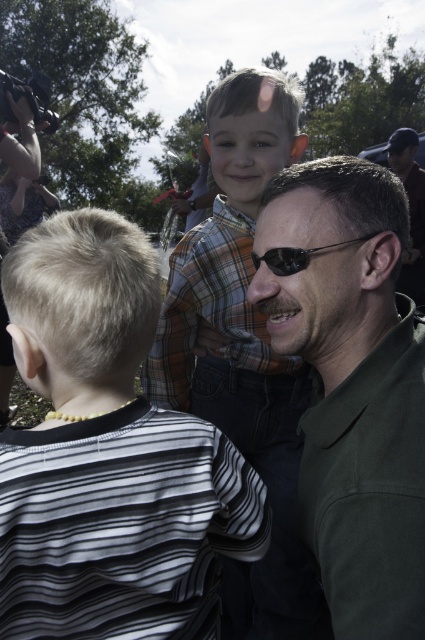
Does plaid shirt at center have a smaller size compared to black plastic sunglasses at center?

Actually, plaid shirt at center might be larger than black plastic sunglasses at center.

Image resolution: width=425 pixels, height=640 pixels. Identify the location of plaid shirt at center. (241, 346).

Image resolution: width=425 pixels, height=640 pixels. Identify the location of plaid shirt at center. point(241,346).

Between point (380, 300) and point (291, 266), which one is positioned behind?

Positioned behind is point (380, 300).

Is the position of green matte shirt at center more distant than that of black plastic sunglasses at center?

No, green matte shirt at center is in front of black plastic sunglasses at center.

Measure the distance between point (254, 289) and camera.

A distance of 38.62 inches exists between point (254, 289) and camera.

Where is `green matte shirt at center`? Image resolution: width=425 pixels, height=640 pixels. green matte shirt at center is located at coordinates (351, 385).

Is black striped shirt at left closer to the viewer compared to green matte shirt at center?

No, it is behind green matte shirt at center.

This screenshot has height=640, width=425. Find the location of `black striped shirt at left`. black striped shirt at left is located at coordinates (108, 456).

This screenshot has width=425, height=640. Identify the location of black striped shirt at left. (108, 456).